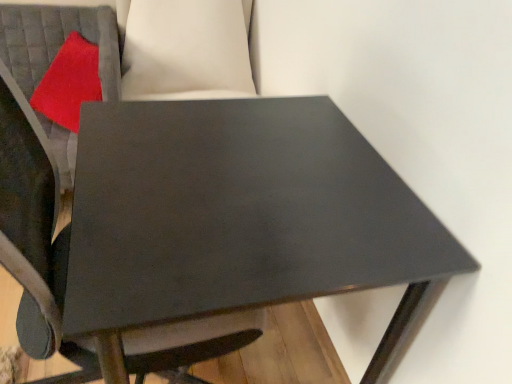
Question: Is point (106, 307) positioned closer to the camera than point (74, 84)?

Choices:
 (A) closer
 (B) farther

Answer: (A)

Question: In the image, is matte black table at center positioned in front of or behind red velvet pillow at upper left?

Choices:
 (A) behind
 (B) front

Answer: (B)

Question: From a real-world perspective, is matte black table at center positioned above or below red velvet pillow at upper left?

Choices:
 (A) above
 (B) below

Answer: (B)

Question: In terms of size, does red velvet pillow at upper left appear bigger or smaller than matte black table at center?

Choices:
 (A) small
 (B) big

Answer: (A)

Question: In the image, is red velvet pillow at upper left on the left side or the right side of matte black table at center?

Choices:
 (A) right
 (B) left

Answer: (B)

Question: From the image's perspective, is red velvet pillow at upper left located above or below matte black table at center?

Choices:
 (A) above
 (B) below

Answer: (A)

Question: From a real-world perspective, is red velvet pillow at upper left above or below matte black table at center?

Choices:
 (A) below
 (B) above

Answer: (B)